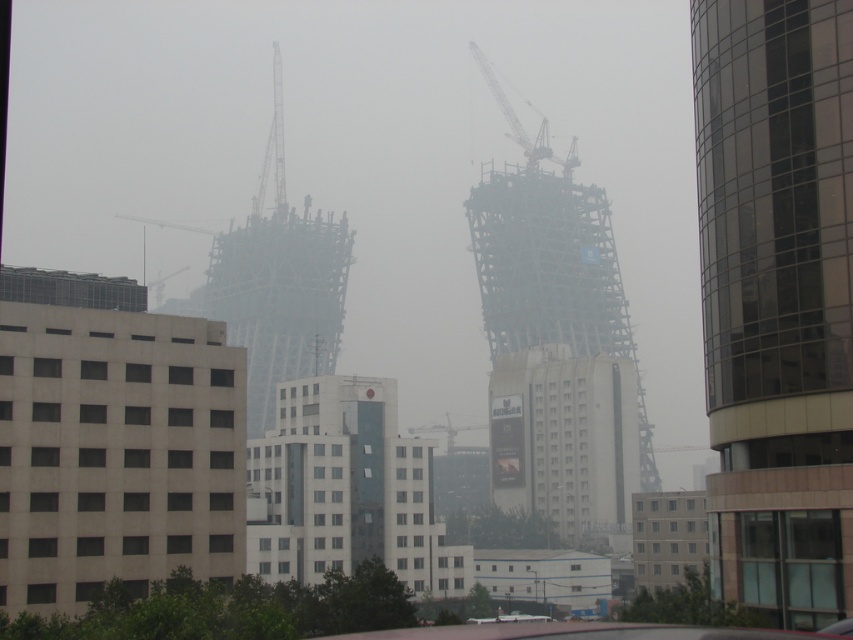
Does white glass building at center have a greater height compared to metallic scaffolding tower at center?

No, white glass building at center is not taller than metallic scaffolding tower at center.

This screenshot has width=853, height=640. What do you see at coordinates (346, 490) in the screenshot? I see `white glass building at center` at bounding box center [346, 490].

Identify the location of white glass building at center. The width and height of the screenshot is (853, 640). (346, 490).

Does glassy reflective tower at right have a greater width compared to metallic gray crane at center?

Incorrect, glassy reflective tower at right's width does not surpass metallic gray crane at center's.

Between glassy reflective tower at right and metallic gray crane at center, which one appears on the right side from the viewer's perspective?

From the viewer's perspective, glassy reflective tower at right appears more on the right side.

The height and width of the screenshot is (640, 853). I want to click on glassy reflective tower at right, so click(776, 298).

Can you confirm if wooden scaffolding at center is positioned below metallic gray crane at center?

Incorrect, wooden scaffolding at center is not positioned below metallic gray crane at center.

What do you see at coordinates (550, 268) in the screenshot? The width and height of the screenshot is (853, 640). I see `wooden scaffolding at center` at bounding box center [550, 268].

The width and height of the screenshot is (853, 640). I want to click on wooden scaffolding at center, so click(550, 268).